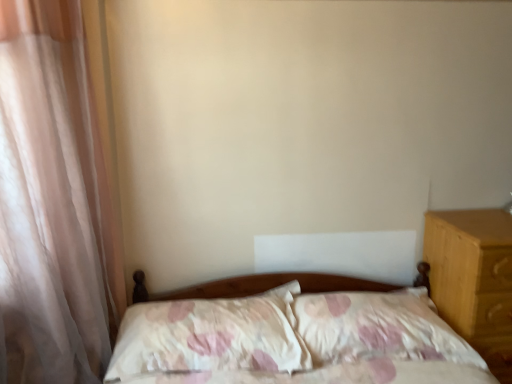
The height and width of the screenshot is (384, 512). What do you see at coordinates (474, 279) in the screenshot? I see `light brown wood at right` at bounding box center [474, 279].

The width and height of the screenshot is (512, 384). What do you see at coordinates (210, 336) in the screenshot?
I see `fluffy white pillow at center, which ranks as the second pillow in right-to-left order` at bounding box center [210, 336].

This screenshot has width=512, height=384. Identify the location of fluffy white pillow at center, placed as the 1th pillow when sorted from right to left. (378, 328).

Describe the element at coordinates (378, 328) in the screenshot. I see `fluffy white pillow at center, placed as the 1th pillow when sorted from right to left` at that location.

The height and width of the screenshot is (384, 512). I want to click on light brown wood at right, so click(x=474, y=279).

Is fluffy white pillow at center, which is the 1th pillow in left-to-right order, completely or partially inside sheer white curtain at left?

Definitely not — fluffy white pillow at center, which is the 1th pillow in left-to-right order, is not inside sheer white curtain at left.

Considering the relative sizes of sheer white curtain at left and fluffy white pillow at center, which ranks as the second pillow in right-to-left order, in the image provided, is sheer white curtain at left taller than fluffy white pillow at center, which ranks as the second pillow in right-to-left order,?

Yes, sheer white curtain at left is taller than fluffy white pillow at center, which ranks as the second pillow in right-to-left order.

Is sheer white curtain at left thinner than fluffy white pillow at center, which is the 1th pillow in left-to-right order?

Yes.

Is sheer white curtain at left oriented away from fluffy white pillow at center, which ranks as the second pillow in right-to-left order?

No, fluffy white pillow at center, which ranks as the second pillow in right-to-left order, is not at the back of sheer white curtain at left.

In the image, is fluffy white pillow at center, which ranks as the second pillow in right-to-left order, positioned in front of or behind light brown wood at right?

Clearly, fluffy white pillow at center, which ranks as the second pillow in right-to-left order, is in front of light brown wood at right.

Which object is positioned more to the right, fluffy white pillow at center, which is the 1th pillow in left-to-right order, or light brown wood at right?

light brown wood at right.

Does fluffy white pillow at center, which ranks as the second pillow in right-to-left order, touch light brown wood at right?

No, fluffy white pillow at center, which ranks as the second pillow in right-to-left order, is not with light brown wood at right.

From a real-world perspective, which is physically above, sheer white curtain at left or fluffy white pillow at center, placed as the 1th pillow when sorted from right to left?

sheer white curtain at left is physically above.

Considering the relative sizes of sheer white curtain at left and fluffy white pillow at center, placed as the 1th pillow when sorted from right to left, in the image provided, is sheer white curtain at left taller than fluffy white pillow at center, placed as the 1th pillow when sorted from right to left,?

Indeed, sheer white curtain at left has a greater height compared to fluffy white pillow at center, placed as the 1th pillow when sorted from right to left.

Measure the distance from sheer white curtain at left to fluffy white pillow at center, placed as the 1th pillow when sorted from right to left.

sheer white curtain at left is 3.50 feet from fluffy white pillow at center, placed as the 1th pillow when sorted from right to left.

Is sheer white curtain at left to the left of fluffy white pillow at center, arranged as the second pillow when viewed from the left, from the viewer's perspective?

Correct, you'll find sheer white curtain at left to the left of fluffy white pillow at center, arranged as the second pillow when viewed from the left.

From the image's perspective, which is above, light brown wood at right or fluffy white pillow at center, arranged as the second pillow when viewed from the left?

fluffy white pillow at center, arranged as the second pillow when viewed from the left.

Can you tell me how much light brown wood at right and fluffy white pillow at center, arranged as the second pillow when viewed from the left, differ in facing direction?

The angle between the facing direction of light brown wood at right and the facing direction of fluffy white pillow at center, arranged as the second pillow when viewed from the left, is 1.76 degrees.

Is light brown wood at right wider or thinner than fluffy white pillow at center, arranged as the second pillow when viewed from the left?

light brown wood at right is wider than fluffy white pillow at center, arranged as the second pillow when viewed from the left.

Who is bigger, light brown wood at right or fluffy white pillow at center, placed as the 1th pillow when sorted from right to left?

Bigger between the two is light brown wood at right.

Considering the relative sizes of fluffy white pillow at center, which ranks as the second pillow in right-to-left order, and fluffy white pillow at center, arranged as the second pillow when viewed from the left, in the image provided, is fluffy white pillow at center, which ranks as the second pillow in right-to-left order, taller than fluffy white pillow at center, arranged as the second pillow when viewed from the left,?

Incorrect, the height of fluffy white pillow at center, which ranks as the second pillow in right-to-left order, is not larger of that of fluffy white pillow at center, arranged as the second pillow when viewed from the left.

Between fluffy white pillow at center, which ranks as the second pillow in right-to-left order, and fluffy white pillow at center, placed as the 1th pillow when sorted from right to left, which one appears on the left side from the viewer's perspective?

fluffy white pillow at center, which ranks as the second pillow in right-to-left order.

Does fluffy white pillow at center, which is the 1th pillow in left-to-right order, have a lesser width compared to fluffy white pillow at center, placed as the 1th pillow when sorted from right to left?

Yes, fluffy white pillow at center, which is the 1th pillow in left-to-right order, is thinner than fluffy white pillow at center, placed as the 1th pillow when sorted from right to left.

Is fluffy white pillow at center, which ranks as the second pillow in right-to-left order, in front of fluffy white pillow at center, placed as the 1th pillow when sorted from right to left?

Yes, fluffy white pillow at center, which ranks as the second pillow in right-to-left order, is closer to the viewer.

Does fluffy white pillow at center, arranged as the second pillow when viewed from the left, have a smaller size compared to fluffy white pillow at center, which ranks as the second pillow in right-to-left order?

Actually, fluffy white pillow at center, arranged as the second pillow when viewed from the left, might be larger than fluffy white pillow at center, which ranks as the second pillow in right-to-left order.

Considering the sizes of fluffy white pillow at center, placed as the 1th pillow when sorted from right to left, and fluffy white pillow at center, which is the 1th pillow in left-to-right order, in the image, is fluffy white pillow at center, placed as the 1th pillow when sorted from right to left, taller or shorter than fluffy white pillow at center, which is the 1th pillow in left-to-right order,?

Considering their sizes, fluffy white pillow at center, placed as the 1th pillow when sorted from right to left, has more height than fluffy white pillow at center, which is the 1th pillow in left-to-right order.

Visually, is fluffy white pillow at center, placed as the 1th pillow when sorted from right to left, positioned to the left or to the right of fluffy white pillow at center, which is the 1th pillow in left-to-right order?

Based on their positions, fluffy white pillow at center, placed as the 1th pillow when sorted from right to left, is located to the right of fluffy white pillow at center, which is the 1th pillow in left-to-right order.

Considering the relative sizes of light brown wood at right and sheer white curtain at left in the image provided, is light brown wood at right bigger than sheer white curtain at left?

Yes, light brown wood at right is bigger than sheer white curtain at left.

Relative to sheer white curtain at left, is light brown wood at right in front or behind?

Clearly, light brown wood at right is behind sheer white curtain at left.

From a real-world perspective, does light brown wood at right sit lower than sheer white curtain at left?

Yes, from a real-world perspective, light brown wood at right is beneath sheer white curtain at left.

Considering the relative positions of light brown wood at right and sheer white curtain at left in the image provided, is light brown wood at right to the left or to the right of sheer white curtain at left?

light brown wood at right is positioned on sheer white curtain at left's right side.

This screenshot has width=512, height=384. I want to click on the 1st pillow directly beneath the sheer white curtain at left (from a real-world perspective), so click(210, 336).

From a real-world perspective, count 2nd pillows upward from the light brown wood at right and point to it. Please provide its 2D coordinates.

[(210, 336)]

From the image, which object appears to be nearer to fluffy white pillow at center, which is the 1th pillow in left-to-right order, light brown wood at right or fluffy white pillow at center, placed as the 1th pillow when sorted from right to left?

fluffy white pillow at center, placed as the 1th pillow when sorted from right to left, lies closer to fluffy white pillow at center, which is the 1th pillow in left-to-right order, than the other object.

Considering their positions, is light brown wood at right positioned closer to sheer white curtain at left than fluffy white pillow at center, which ranks as the second pillow in right-to-left order?

Based on the image, fluffy white pillow at center, which ranks as the second pillow in right-to-left order, appears to be nearer to sheer white curtain at left.

Looking at the image, which one is located closer to sheer white curtain at left, fluffy white pillow at center, arranged as the second pillow when viewed from the left, or light brown wood at right?

fluffy white pillow at center, arranged as the second pillow when viewed from the left, lies closer to sheer white curtain at left than the other object.

From the image, which object appears to be nearer to fluffy white pillow at center, placed as the 1th pillow when sorted from right to left, light brown wood at right or fluffy white pillow at center, which ranks as the second pillow in right-to-left order?

The object closer to fluffy white pillow at center, placed as the 1th pillow when sorted from right to left, is light brown wood at right.

Based on their spatial positions, is sheer white curtain at left or fluffy white pillow at center, placed as the 1th pillow when sorted from right to left, closer to fluffy white pillow at center, which is the 1th pillow in left-to-right order?

Among the two, fluffy white pillow at center, placed as the 1th pillow when sorted from right to left, is located nearer to fluffy white pillow at center, which is the 1th pillow in left-to-right order.

Considering their positions, is fluffy white pillow at center, which ranks as the second pillow in right-to-left order, positioned closer to fluffy white pillow at center, arranged as the second pillow when viewed from the left, than light brown wood at right?

light brown wood at right lies closer to fluffy white pillow at center, arranged as the second pillow when viewed from the left, than the other object.

Looking at the image, which one is located closer to light brown wood at right, fluffy white pillow at center, arranged as the second pillow when viewed from the left, or sheer white curtain at left?

fluffy white pillow at center, arranged as the second pillow when viewed from the left.

Estimate the real-world distances between objects in this image. Which object is further from light brown wood at right, sheer white curtain at left or fluffy white pillow at center, arranged as the second pillow when viewed from the left?

sheer white curtain at left is further to light brown wood at right.

This screenshot has width=512, height=384. Find the location of `pillow between fluffy white pillow at center, which is the 1th pillow in left-to-right order, and light brown wood at right from left to right`. pillow between fluffy white pillow at center, which is the 1th pillow in left-to-right order, and light brown wood at right from left to right is located at coordinates coord(378,328).

The height and width of the screenshot is (384, 512). In order to click on pillow between sheer white curtain at left and fluffy white pillow at center, arranged as the second pillow when viewed from the left, in the horizontal direction in this screenshot , I will do [210, 336].